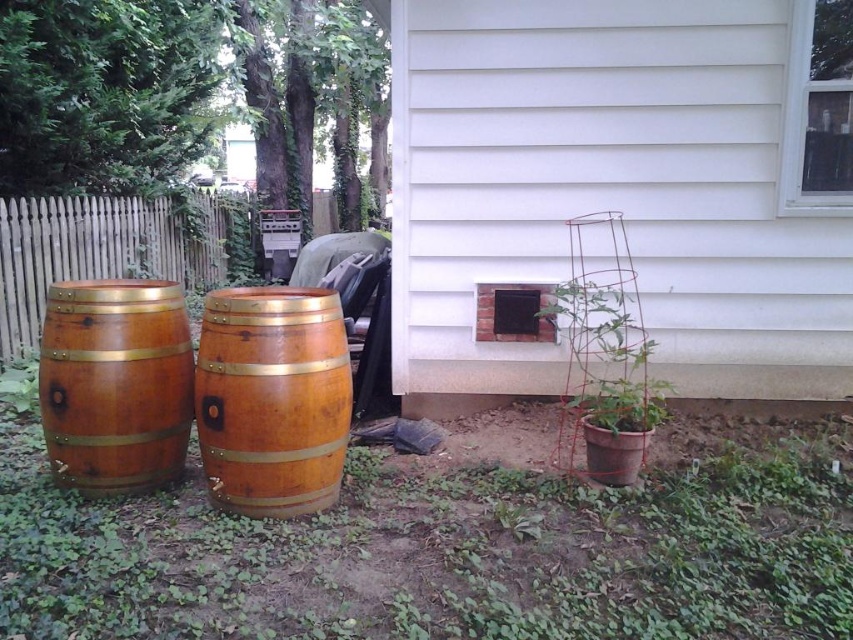
Question: Estimate the real-world distances between objects in this image. Which object is farther from the brick at lower right?

Choices:
 (A) wooden barrel at left
 (B) brown wooden fence at left
 (C) green mesh trellis at lower right

Answer: (B)

Question: Which of the following is the closest to the observer?

Choices:
 (A) wooden barrel at center
 (B) wooden barrel at left
 (C) brick at lower right

Answer: (A)

Question: Which of the following is the farthest from the observer?

Choices:
 (A) brown wooden fence at left
 (B) wooden barrel at center
 (C) wooden barrel at left
 (D) brick at lower right

Answer: (A)

Question: Is brick at lower right positioned at the back of wooden barrel at center?

Choices:
 (A) yes
 (B) no

Answer: (A)

Question: Is brick at lower right bigger than wooden barrel at left?

Choices:
 (A) yes
 (B) no

Answer: (A)

Question: Is brick at lower right bigger than wooden barrel at left?

Choices:
 (A) no
 (B) yes

Answer: (B)